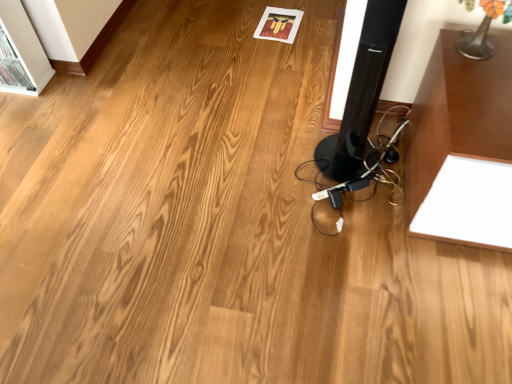
Question: Is metallic silver table lamp at upper right inside or outside of black glossy speaker at center?

Choices:
 (A) outside
 (B) inside

Answer: (A)

Question: From the image's perspective, is metallic silver table lamp at upper right positioned above or below black glossy speaker at center?

Choices:
 (A) above
 (B) below

Answer: (A)

Question: Considering their positions, is metallic silver table lamp at upper right located in front of or behind black glossy speaker at center?

Choices:
 (A) behind
 (B) front

Answer: (A)

Question: Considering the positions of black glossy speaker at center and metallic silver table lamp at upper right in the image, is black glossy speaker at center wider or thinner than metallic silver table lamp at upper right?

Choices:
 (A) thin
 (B) wide

Answer: (B)

Question: Considering their positions, is black glossy speaker at center located in front of or behind metallic silver table lamp at upper right?

Choices:
 (A) front
 (B) behind

Answer: (A)

Question: Considering the positions of point (338, 152) and point (460, 48), is point (338, 152) closer or farther from the camera than point (460, 48)?

Choices:
 (A) farther
 (B) closer

Answer: (A)

Question: From a real-world perspective, is black glossy speaker at center above or below metallic silver table lamp at upper right?

Choices:
 (A) below
 (B) above

Answer: (A)